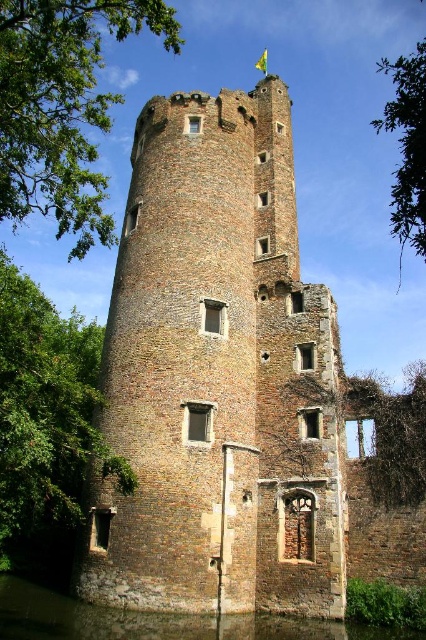
Question: Is green leafy tree at lower left bigger than clear water at lower left?

Choices:
 (A) yes
 (B) no

Answer: (A)

Question: Among these objects, which one is farthest from the camera?

Choices:
 (A) green leafy tree at upper left
 (B) clear water at lower left
 (C) green leafy tree at upper right

Answer: (A)

Question: Is green leafy tree at upper left positioned in front of green leafy tree at upper right?

Choices:
 (A) yes
 (B) no

Answer: (B)

Question: Can you confirm if green leafy tree at upper left is smaller than green leafy tree at upper right?

Choices:
 (A) yes
 (B) no

Answer: (A)

Question: Estimate the real-world distances between objects in this image. Which object is farther from the green leafy tree at lower right?

Choices:
 (A) green leafy tree at upper left
 (B) green leafy tree at lower left
 (C) clear water at lower left

Answer: (A)

Question: Based on their relative distances, which object is farther from the clear water at lower left?

Choices:
 (A) green leafy tree at lower left
 (B) green leafy tree at upper left
 (C) green leafy tree at lower right

Answer: (B)